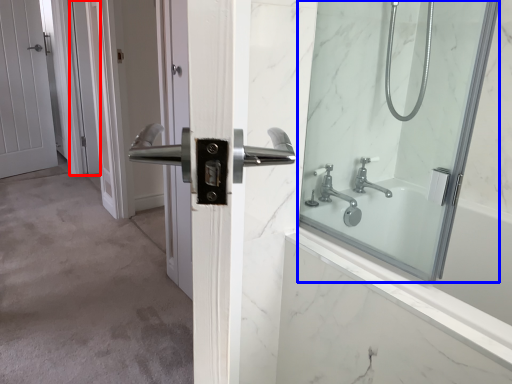
Question: Which of the following is the farthest to the observer, screen door (highlighted by a red box) or mirror (highlighted by a blue box)?

Choices:
 (A) screen door
 (B) mirror

Answer: (A)